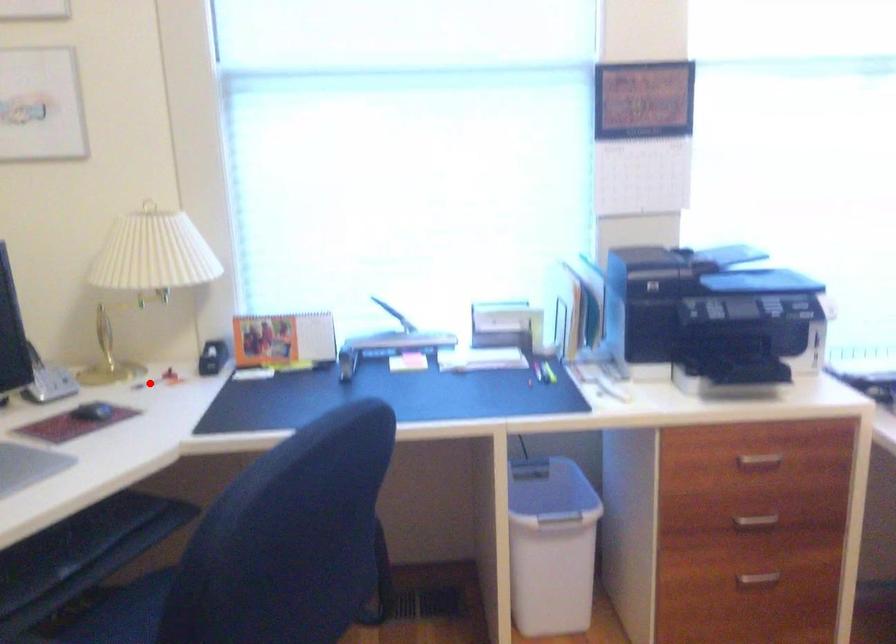
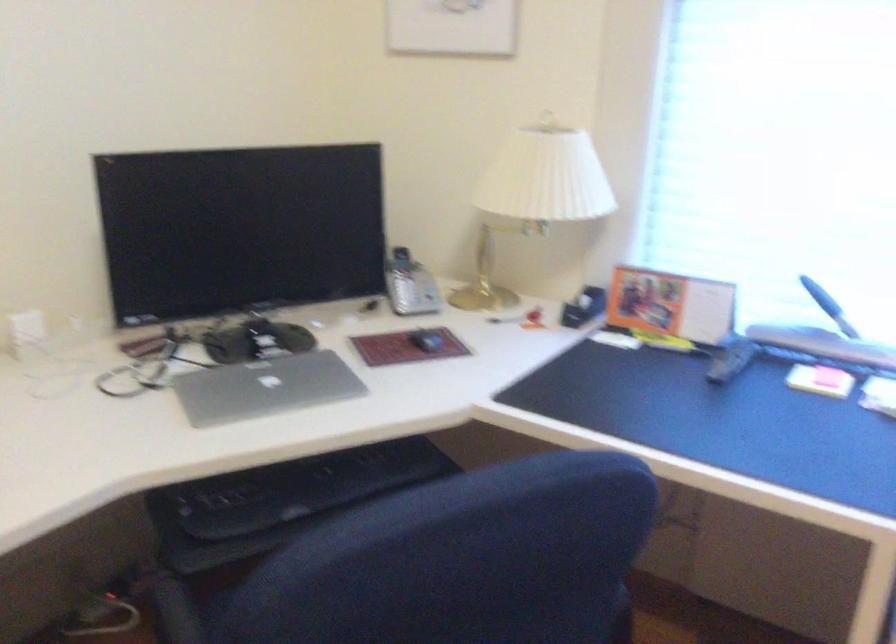
In the second image, find the point that corresponds to the highlighted location in the first image.

(504, 319)